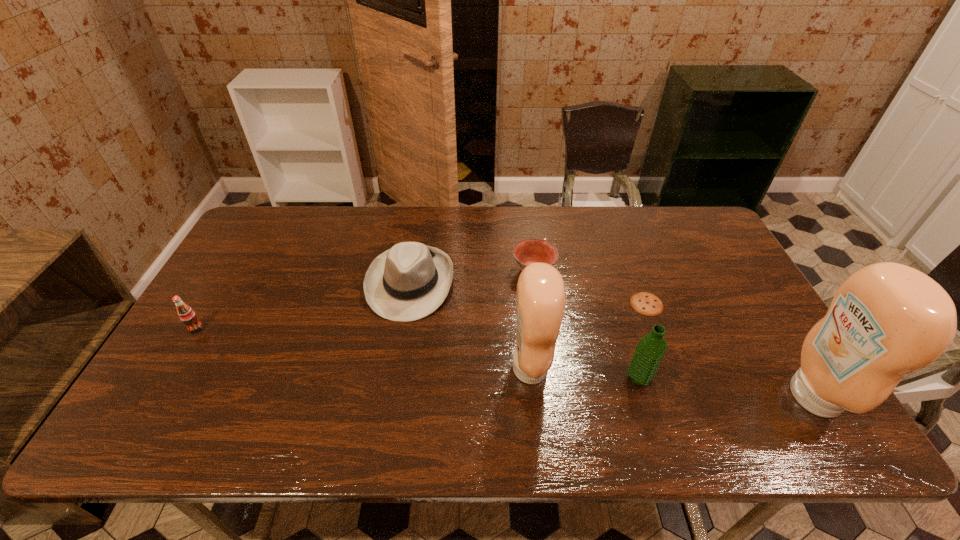
This screenshot has width=960, height=540. I want to click on the third object from right to left, so pos(650,350).

You are a GUI agent. You are given a task and a screenshot of the screen. Output one action in this format:
    pyautogui.click(x=<x>, y=<y>)
    Task: Click on the water bottle
    This screenshot has width=960, height=540.
    Given the screenshot: What is the action you would take?
    650,350

The image size is (960, 540). I want to click on vacant space located 0.320m on the label of the left condiment, so click(x=679, y=368).

I want to click on free space located 0.380m on the label of the rightmost object, so click(629, 396).

Where is `free space located on the label of the rightmost object`? The height and width of the screenshot is (540, 960). free space located on the label of the rightmost object is located at coordinates (687, 396).

The height and width of the screenshot is (540, 960). In order to click on vacant space located on the label of the rightmost object in this screenshot , I will do `click(634, 396)`.

Locate an element on the screen. The height and width of the screenshot is (540, 960). vacant space located 0.080m on the front-facing side of the fedora is located at coordinates (400, 346).

The width and height of the screenshot is (960, 540). In order to click on vacant space located 0.100m on the right of the cookie in this screenshot , I will do `click(698, 304)`.

At what (x,y) coordinates should I click in order to perform the action: click on free spot located 0.070m on the front of the bowl. Please return your answer as a coordinate pair (x, y). The width and height of the screenshot is (960, 540). Looking at the image, I should click on (538, 303).

The width and height of the screenshot is (960, 540). What are the coordinates of `free space located on the back of the soda` in the screenshot? It's located at (238, 258).